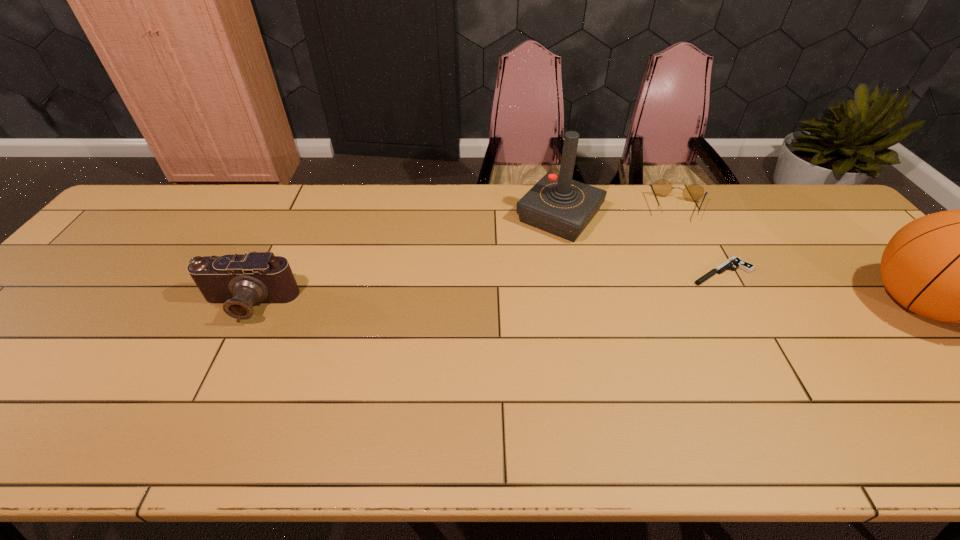
You are a GUI agent. You are given a task and a screenshot of the screen. Output one action in this format:
    pyautogui.click(x=<x>, y=<y>)
    Task: Click on the blank area at the far left corner
    
    Given the screenshot: What is the action you would take?
    pyautogui.click(x=173, y=211)

Identify the location of unoccupied position between the third shortest object and the joystick. This screenshot has width=960, height=540. (404, 261).

Find the location of a particular element. The width and height of the screenshot is (960, 540). vacant point located between the leftmost object and the shortest object is located at coordinates (485, 288).

You are a GUI agent. You are given a task and a screenshot of the screen. Output one action in this format:
    pyautogui.click(x=<x>, y=<y>)
    Task: Click on the vacant point located between the spectacles and the joystick
    Image resolution: width=960 pixels, height=540 pixels.
    Given the screenshot: What is the action you would take?
    pyautogui.click(x=619, y=212)

You are a GUI agent. You are given a task and a screenshot of the screen. Output one action in this format:
    pyautogui.click(x=<x>, y=<y>)
    Task: Click on the free space between the third shortest object and the spectacles
    The height and width of the screenshot is (540, 960).
    Given the screenshot: What is the action you would take?
    pyautogui.click(x=464, y=256)

Identify the location of empty space that is in between the fourth tallest object and the joystick. This screenshot has width=960, height=540. (619, 212).

Where is `the second closest object to the rightmost object`? Image resolution: width=960 pixels, height=540 pixels. the second closest object to the rightmost object is located at coordinates (662, 187).

I want to click on object that is the second closest one to the pistol, so click(556, 204).

Image resolution: width=960 pixels, height=540 pixels. I want to click on free spot that satisfies the following two spatial constraints: 1. on the front side of the pistol; 2. on the right side of the joystick, so pos(571,272).